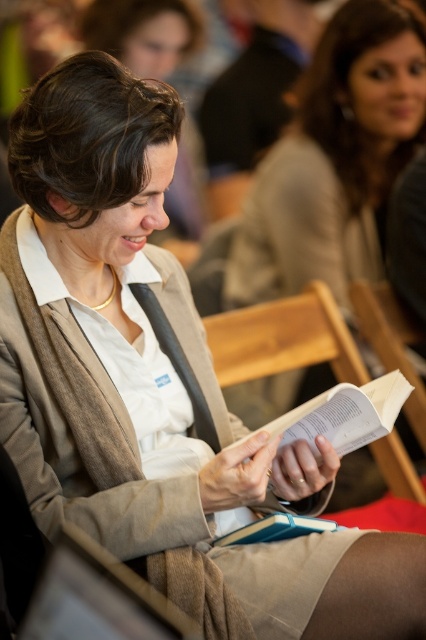
Based on the photo, can you confirm if beige woolen cardigan at center is positioned above wooden chair at center?

No.

Which is behind, point (51, 433) or point (247, 342)?

The point (247, 342) is behind.

Is point (235, 596) closer to viewer compared to point (209, 339)?

Yes.

This screenshot has height=640, width=426. In order to click on beige woolen cardigan at center in this screenshot , I will do [132, 477].